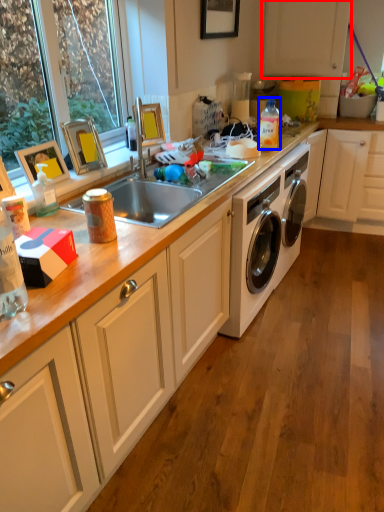
Question: Which object appears closest to the camera in this image, cabinetry (highlighted by a red box) or bottle (highlighted by a blue box)?

Choices:
 (A) cabinetry
 (B) bottle

Answer: (B)